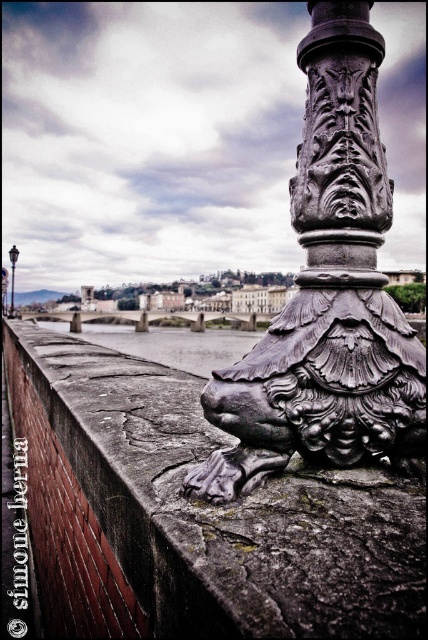
Question: Which object is the farthest from the polished metal column at center?

Choices:
 (A) polished metal lion at center
 (B) rusty stone ledge at center

Answer: (B)

Question: Which object is farther from the camera taking this photo?

Choices:
 (A) rusty stone ledge at center
 (B) polished metal column at center
 (C) polished metal lamp post at upper center

Answer: (C)

Question: Does rusty stone ledge at center appear on the left side of polished metal lamp post at upper center?

Choices:
 (A) no
 (B) yes

Answer: (A)

Question: Considering the relative positions of polished metal lion at center and polished metal column at center in the image provided, where is polished metal lion at center located with respect to polished metal column at center?

Choices:
 (A) left
 (B) right

Answer: (A)

Question: Which object is farther from the camera taking this photo?

Choices:
 (A) polished metal lion at center
 (B) polished metal column at center
 (C) rusty stone ledge at center

Answer: (B)

Question: Can you confirm if polished metal lion at center is positioned below polished metal column at center?

Choices:
 (A) yes
 (B) no

Answer: (A)